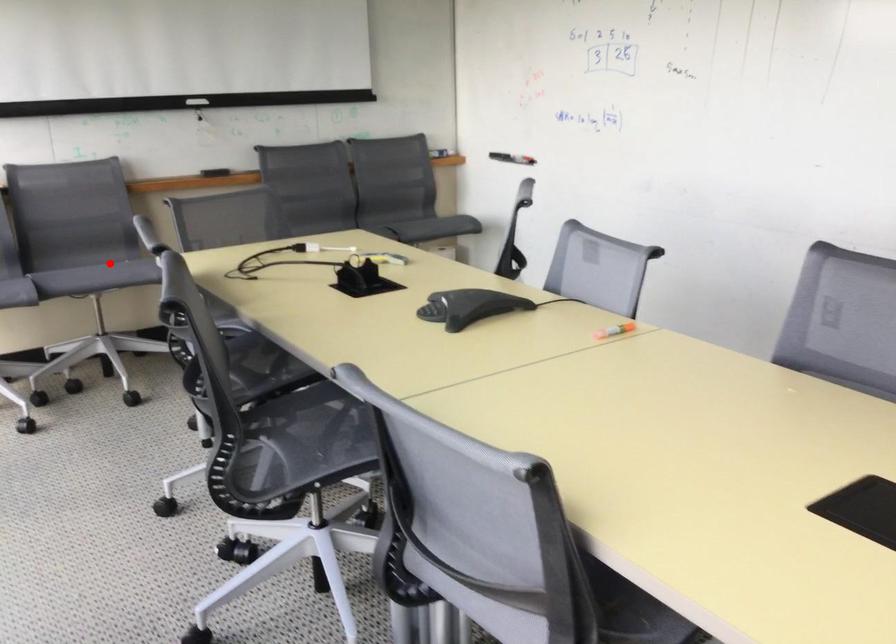
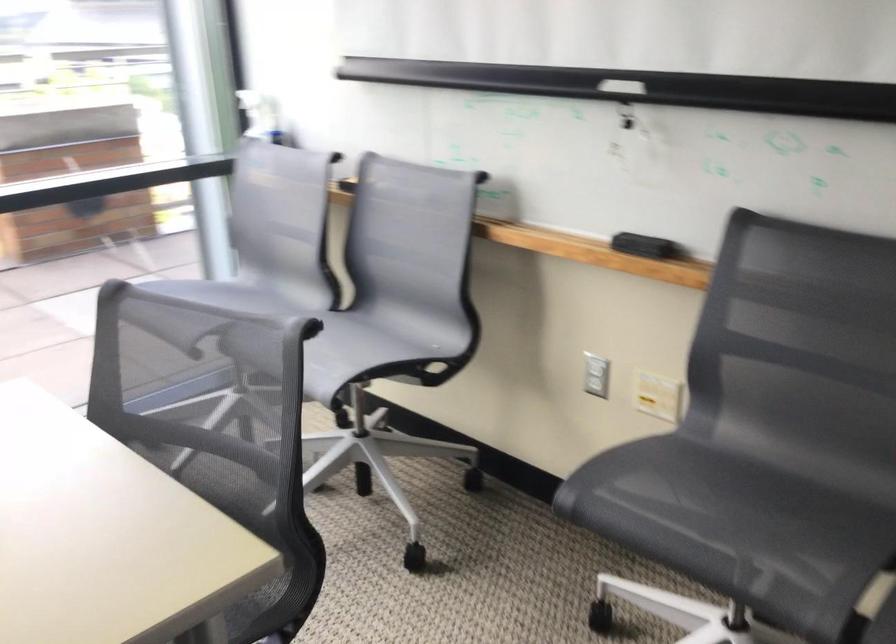
Question: I am providing you with two images of the same scene from different viewpoints. In image1, a red point is highlighted. Considering the same 3D point in image2, which of the following is correct?

Choices:
 (A) It is closer
 (B) It is farther

Answer: (A)